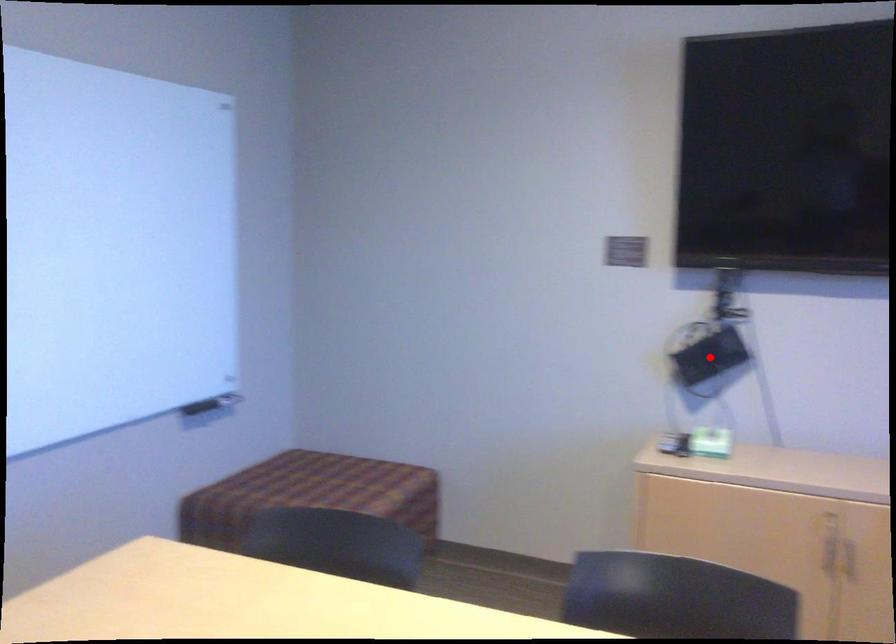
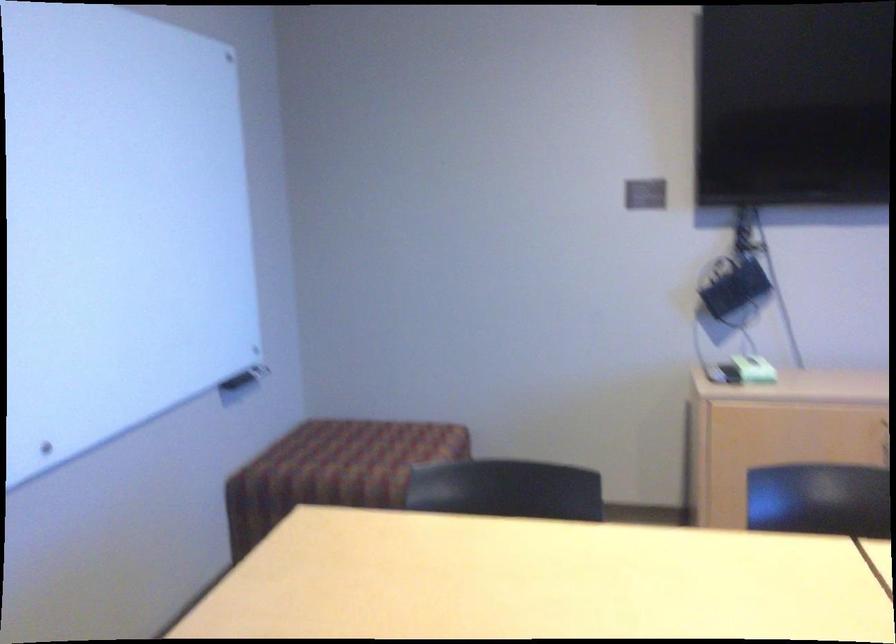
Find the pixel in the second image that matches the highlighted location in the first image.

(734, 289)